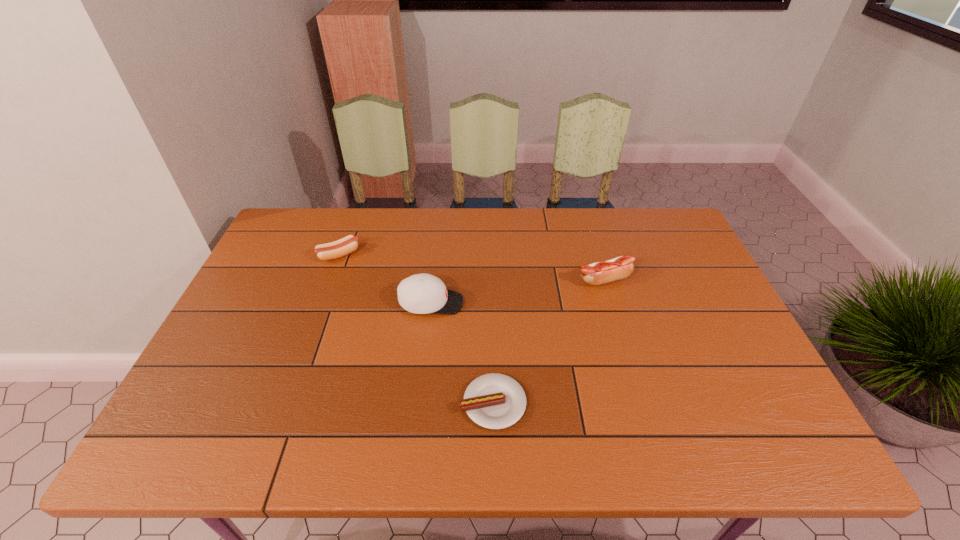
You are a GUI agent. You are given a task and a screenshot of the screen. Output one action in this format:
    pyautogui.click(x=<x>, y=<y>)
    Task: Click on the vacant area that lies between the second shortest object and the third shortest object
    Image resolution: width=960 pixels, height=540 pixels.
    Given the screenshot: What is the action you would take?
    pyautogui.click(x=471, y=267)

You are a GUI agent. You are given a task and a screenshot of the screen. Output one action in this format:
    pyautogui.click(x=<x>, y=<y>)
    Task: Click on the empty location between the tallest sausage and the shortest object
    Image resolution: width=960 pixels, height=540 pixels.
    Given the screenshot: What is the action you would take?
    pyautogui.click(x=548, y=341)

At what (x,y) coordinates should I click in order to perform the action: click on empty location between the farthest object and the second nearest sausage. Please return your answer as a coordinate pair (x, y). This screenshot has height=540, width=960. Looking at the image, I should click on (471, 267).

Find the location of a particular element. This screenshot has width=960, height=540. free space between the second sausage from right to left and the baseball cap is located at coordinates (x=462, y=353).

At what (x,y) coordinates should I click in order to perform the action: click on free space between the tallest object and the farthest object. Please return your answer as a coordinate pair (x, y). Image resolution: width=960 pixels, height=540 pixels. Looking at the image, I should click on (385, 279).

Identify the location of vacant region between the leftmost object and the nearest sausage. The image size is (960, 540). (416, 329).

Identify the location of free space between the nearest object and the tallest object. The image size is (960, 540). (462, 353).

This screenshot has width=960, height=540. What are the coordinates of `free space between the baseball cap and the third tallest object` in the screenshot? It's located at (385, 279).

Image resolution: width=960 pixels, height=540 pixels. What are the coordinates of `vacant area between the baseball cap and the shortest sausage` in the screenshot? It's located at (462, 353).

What are the coordinates of `object that ranks as the third closest to the shortest sausage` in the screenshot? It's located at (348, 244).